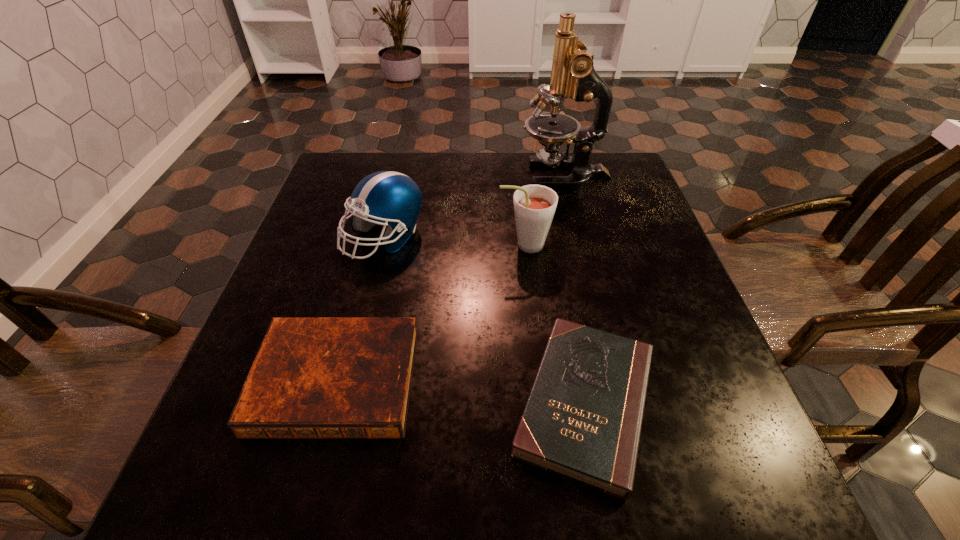
What are the coordinates of `the tallest object` in the screenshot? It's located at (573, 75).

Where is `the farthest object`? The image size is (960, 540). the farthest object is located at coordinates (573, 75).

Where is `root beer`? This screenshot has height=540, width=960. root beer is located at coordinates (534, 205).

Identify the location of football helmet. The width and height of the screenshot is (960, 540). (393, 198).

Image resolution: width=960 pixels, height=540 pixels. Identify the location of the left Bible. (312, 377).

Where is `the right Bible`? Image resolution: width=960 pixels, height=540 pixels. the right Bible is located at coordinates (582, 420).

You are a GUI agent. You are given a task and a screenshot of the screen. Output one action in this format:
    pyautogui.click(x=<x>, y=<y>)
    Task: Click on the free space located at the eyepiece of the microscope
    This screenshot has height=540, width=960.
    Given the screenshot: What is the action you would take?
    pyautogui.click(x=485, y=176)

Where is `free location located at the eyepiece of the microscope`? free location located at the eyepiece of the microscope is located at coordinates (381, 176).

This screenshot has width=960, height=540. Find the location of `free location located at the eyepiece of the microscope`. free location located at the eyepiece of the microscope is located at coordinates (420, 176).

This screenshot has height=540, width=960. I want to click on vacant space situated 0.180m on the drink side of the root beer, so click(x=420, y=245).